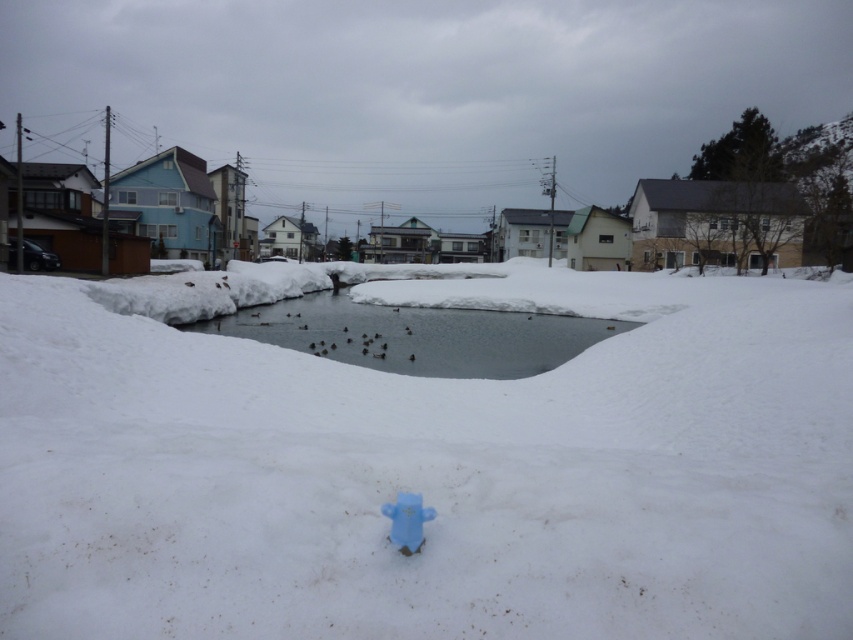
You are a delivery drone that needs to fly from the blue plastic hydrant at center to the clear ice water at center. Given that your drone has a maximum flight range of 25 meters, can you safely make this trip without needing to recharge?

The clear ice water at center is 23.90 meters from blue plastic hydrant at center. Since the distance is within the drone maximum flight range of 25 meters, the drone can safely make the trip without needing to recharge.

You are a delivery robot that needs to move from the white fluffy snow at center to the clear ice water at center. The robot has a maximum obstacle clearance height of 0.5 meters. Is there any obstacle between them that might block the path?

The white fluffy snow at center and clear ice water at center are 5.86 meters apart. Since there are no objects mentioned between them in the scene description, the path is clear for the robot to move as long as the distance is within its operational range. However, the question mentions maximum obstacle clearance height, but the scene doesn not describe any obstacles in between, so the robot can proceed.

Based on the photo, you are standing at the center of the snowy urban scene and want to reach the clear ice water at center. Which direction should you move to get there?

The clear ice water at center is already at the center point, so you are already at the correct location.